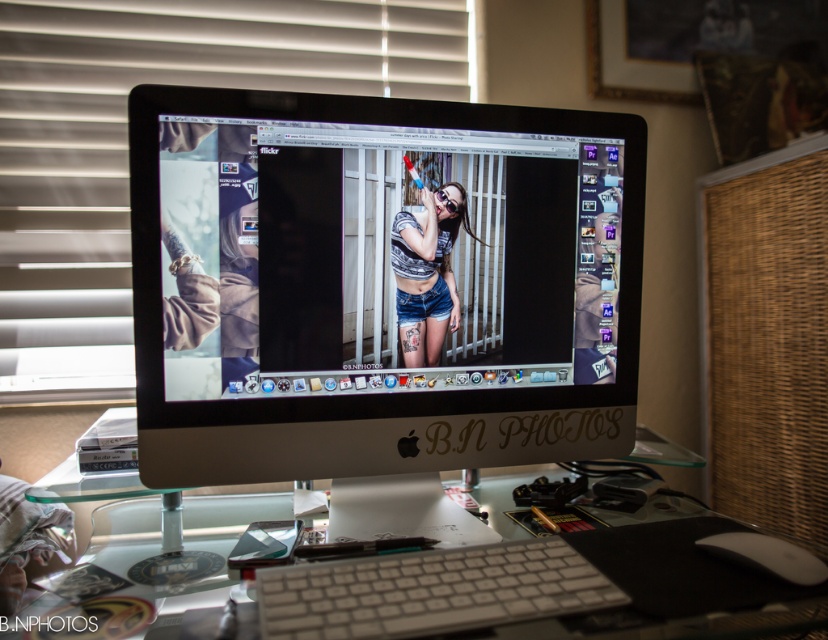
Question: Does white plastic keyboard at center appear on the left side of clear glass computer desk at center?

Choices:
 (A) yes
 (B) no

Answer: (B)

Question: In this image, where is satin silver monitor at center located relative to denim shorts at center?

Choices:
 (A) above
 (B) below

Answer: (B)

Question: Is satin silver monitor at center below white matte blinds at upper left?

Choices:
 (A) yes
 (B) no

Answer: (A)

Question: Which of the following is the farthest from the observer?

Choices:
 (A) (634, 545)
 (B) (585, 332)
 (C) (434, 259)
 (D) (326, 586)

Answer: (B)

Question: Which point is closer to the camera?

Choices:
 (A) denim shorts at center
 (B) satin silver monitor at center
 (C) white plastic keyboard at center
 (D) clear glass computer desk at center

Answer: (C)

Question: Considering the real-world distances, which object is farthest from the clear glass computer desk at center?

Choices:
 (A) white plastic keyboard at center
 (B) satin silver monitor at center

Answer: (B)